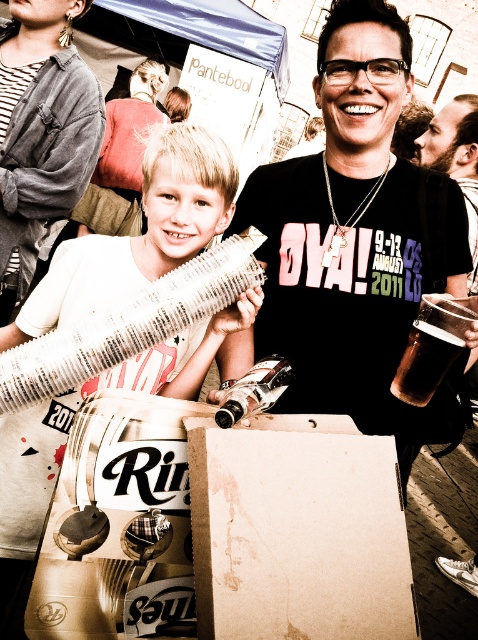
Question: Which object is positioned farthest from the clear glass bottle at center?

Choices:
 (A) brown matte glass at center
 (B) black matte t-shirt at center

Answer: (B)

Question: Which of these objects is positioned closest to the brown matte glass at center?

Choices:
 (A) white paper accordion at center
 (B) brown cardboard box at center
 (C) clear glass bottle at center

Answer: (C)

Question: Among these objects, which one is farthest from the camera?

Choices:
 (A) brown matte glass at center
 (B) black matte t-shirt at center

Answer: (B)

Question: Is brown matte glass at center to the right of clear glass bottle at center from the viewer's perspective?

Choices:
 (A) no
 (B) yes

Answer: (B)

Question: Is brushed metal can at upper center thinner than clear glass bottle at center?

Choices:
 (A) yes
 (B) no

Answer: (B)

Question: Does black matte t-shirt at center have a smaller size compared to brown cardboard box at center?

Choices:
 (A) no
 (B) yes

Answer: (A)